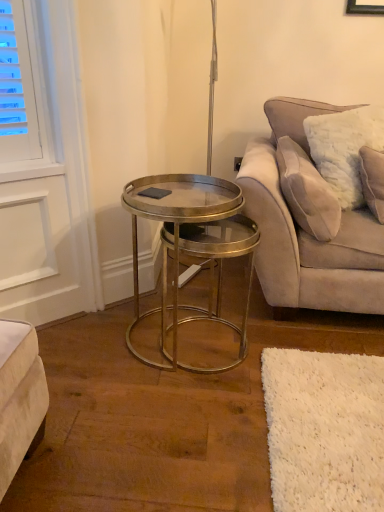
Question: From a real-world perspective, is white fluffy pillow at upper right on top of velvet beige couch at right?

Choices:
 (A) no
 (B) yes

Answer: (B)

Question: Considering the relative sizes of white fluffy pillow at upper right and velvet beige couch at right in the image provided, is white fluffy pillow at upper right bigger than velvet beige couch at right?

Choices:
 (A) no
 (B) yes

Answer: (A)

Question: Is the surface of white fluffy pillow at upper right in direct contact with velvet beige couch at right?

Choices:
 (A) yes
 (B) no

Answer: (A)

Question: Is white fluffy pillow at upper right turned away from velvet beige couch at right?

Choices:
 (A) yes
 (B) no

Answer: (A)

Question: Is the depth of white fluffy pillow at upper right less than that of velvet beige couch at right?

Choices:
 (A) no
 (B) yes

Answer: (A)

Question: Can you confirm if white fluffy pillow at upper right is positioned to the right of velvet beige couch at right?

Choices:
 (A) yes
 (B) no

Answer: (B)

Question: Is metallic/glass coffee table at center wider than velvet beige couch at right?

Choices:
 (A) yes
 (B) no

Answer: (B)

Question: Is metallic/glass coffee table at center positioned with its back to velvet beige couch at right?

Choices:
 (A) no
 (B) yes

Answer: (A)

Question: Is metallic/glass coffee table at center facing towards velvet beige couch at right?

Choices:
 (A) no
 (B) yes

Answer: (A)

Question: Is metallic/glass coffee table at center outside velvet beige couch at right?

Choices:
 (A) no
 (B) yes

Answer: (B)

Question: From a real-world perspective, does metallic/glass coffee table at center stand above velvet beige couch at right?

Choices:
 (A) yes
 (B) no

Answer: (B)

Question: Does metallic/glass coffee table at center have a smaller size compared to velvet beige couch at right?

Choices:
 (A) yes
 (B) no

Answer: (A)

Question: Considering the relative sizes of white fluffy pillow at upper right and metallic/glass coffee table at center in the image provided, is white fluffy pillow at upper right thinner than metallic/glass coffee table at center?

Choices:
 (A) yes
 (B) no

Answer: (A)